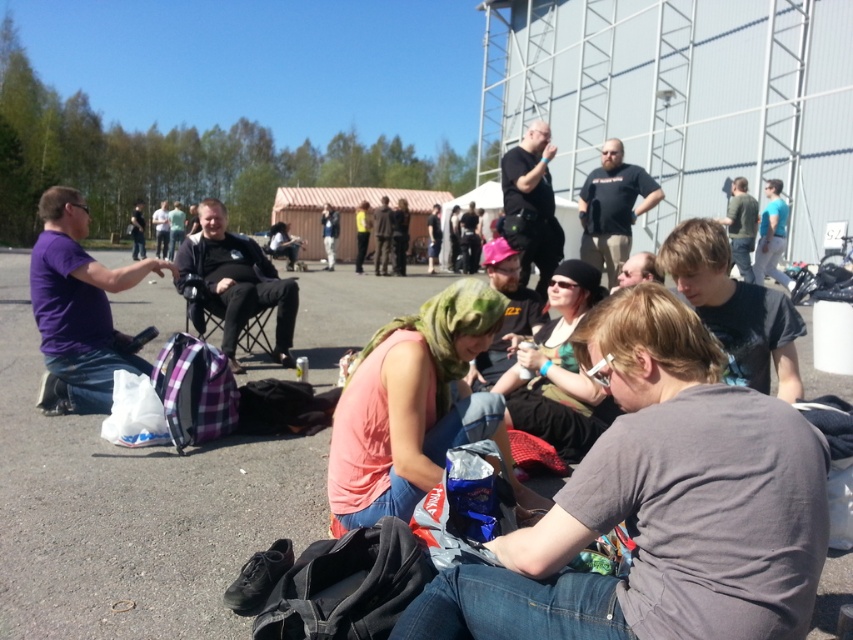
Question: Is black fabric chair at center positioned before green fabric shirt at upper right?

Choices:
 (A) yes
 (B) no

Answer: (A)

Question: Is purple matte shirt at left positioned behind black matte shirt at center?

Choices:
 (A) no
 (B) yes

Answer: (A)

Question: Which of the following is the farthest from the observer?

Choices:
 (A) (114, 356)
 (B) (749, 250)
 (C) (776, 208)

Answer: (C)

Question: Can you confirm if purple matte shirt at left is bigger than black fabric chair at center?

Choices:
 (A) yes
 (B) no

Answer: (A)

Question: Which point appears farthest from the camera in this image?

Choices:
 (A) (88, 378)
 (B) (752, 241)

Answer: (B)

Question: Which object appears closest to the camera in this image?

Choices:
 (A) dark gray fabric jacket at center
 (B) blue t-shirt at upper right
 (C) black fabric chair at center

Answer: (C)